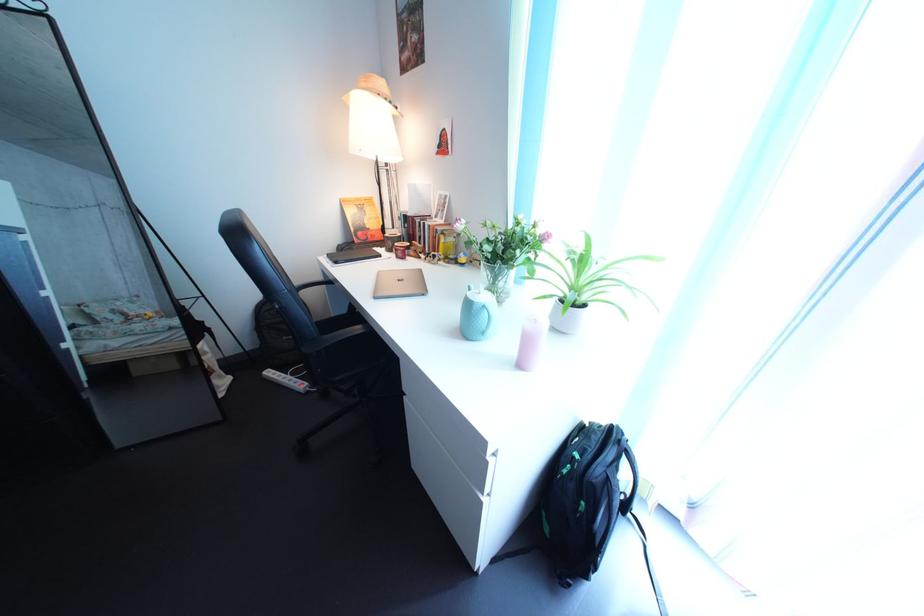
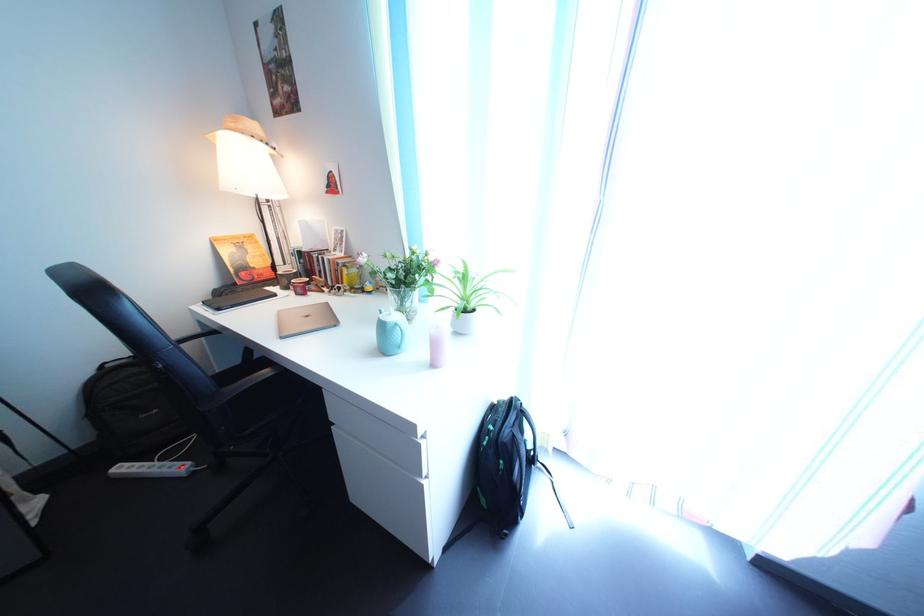
Question: What movement of the cameraman would produce the second image?

Choices:
 (A) Left
 (B) Right
 (C) Forward
 (D) Backward

Answer: (D)